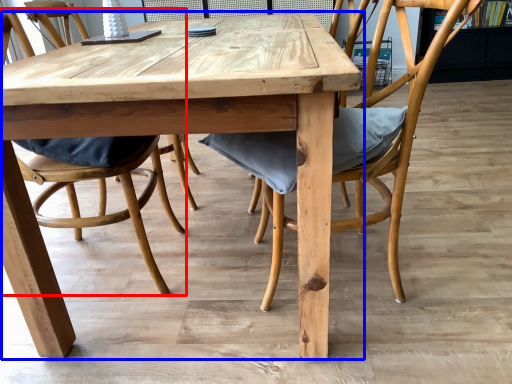
Question: Which point is further to the camera, chair (highlighted by a red box) or kitchen & dining room table (highlighted by a blue box)?

Choices:
 (A) chair
 (B) kitchen & dining room table

Answer: (A)